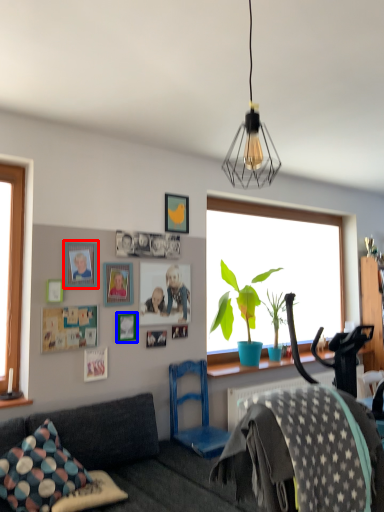
Question: Which object is closer to the camera taking this photo, picture frame (highlighted by a red box) or picture frame (highlighted by a blue box)?

Choices:
 (A) picture frame
 (B) picture frame

Answer: (A)